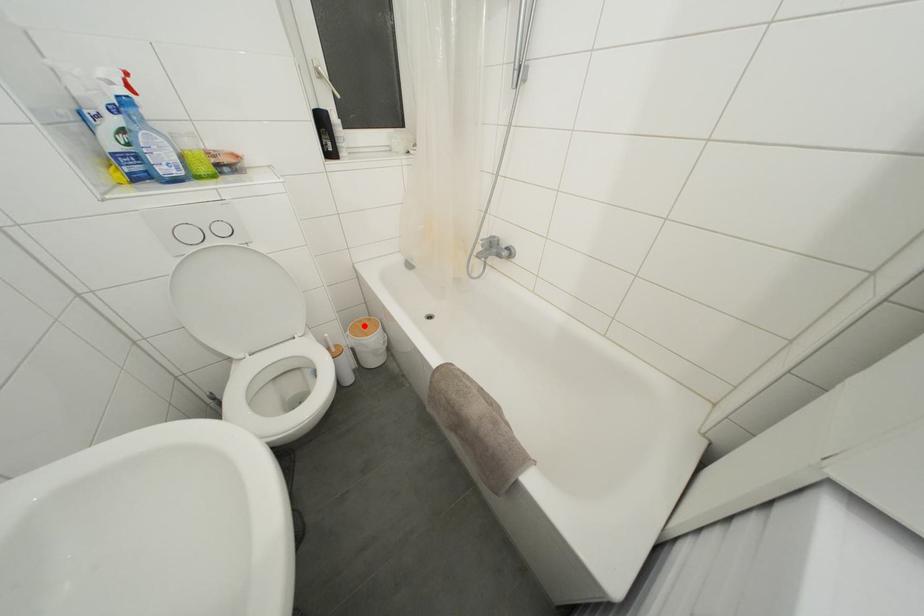
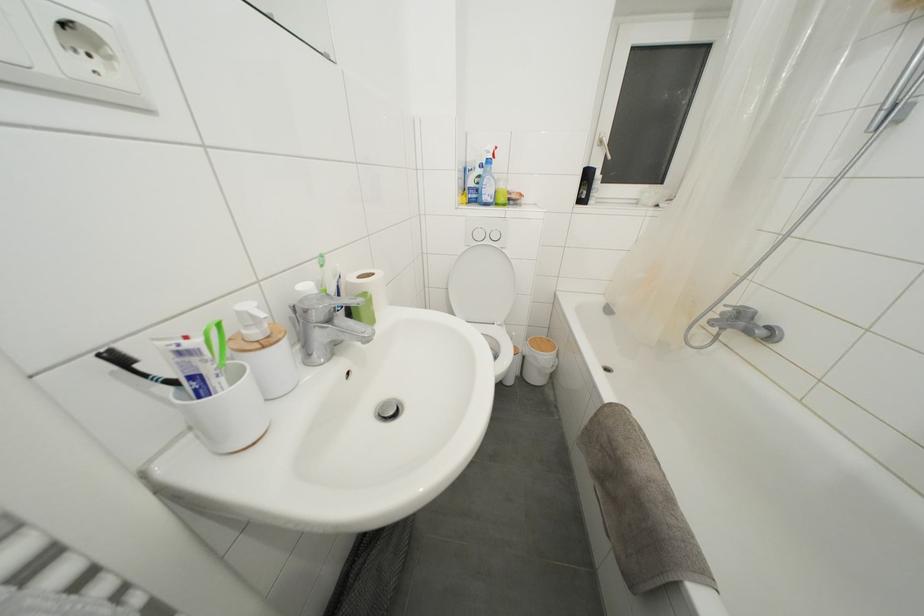
Question: A red point is marked in image1. In image2, is the corresponding 3D point closer to the camera or farther? Reply with the corresponding letter.

Choices:
 (A) The corresponding 3D point is closer.
 (B) The corresponding 3D point is farther.

Answer: (B)